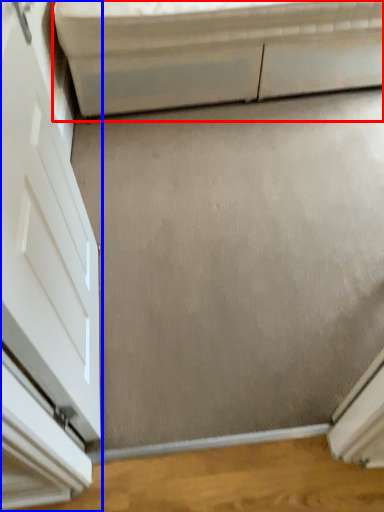
Question: Which object is further to the camera taking this photo, furniture (highlighted by a red box) or door (highlighted by a blue box)?

Choices:
 (A) furniture
 (B) door

Answer: (A)